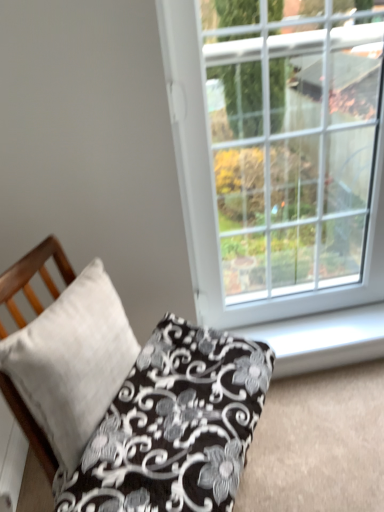
Question: From a real-world perspective, is white plastic window sill at lower right located beneath white plastic window at upper right?

Choices:
 (A) yes
 (B) no

Answer: (A)

Question: Does white plastic window sill at lower right have a greater height compared to white plastic window at upper right?

Choices:
 (A) no
 (B) yes

Answer: (A)

Question: Is white plastic window sill at lower right to the left of white plastic window at upper right from the viewer's perspective?

Choices:
 (A) yes
 (B) no

Answer: (B)

Question: Is white plastic window sill at lower right wider than white plastic window at upper right?

Choices:
 (A) yes
 (B) no

Answer: (A)

Question: From a real-world perspective, is white plastic window sill at lower right on top of white plastic window at upper right?

Choices:
 (A) no
 (B) yes

Answer: (A)

Question: Is white plastic window sill at lower right positioned behind white plastic window at upper right?

Choices:
 (A) no
 (B) yes

Answer: (B)

Question: Can you confirm if white plastic window at upper right is shorter than white plastic window sill at lower right?

Choices:
 (A) yes
 (B) no

Answer: (B)

Question: Is white plastic window at upper right far away from white plastic window sill at lower right?

Choices:
 (A) yes
 (B) no

Answer: (B)

Question: Considering the relative sizes of white plastic window at upper right and white plastic window sill at lower right in the image provided, is white plastic window at upper right taller than white plastic window sill at lower right?

Choices:
 (A) yes
 (B) no

Answer: (A)

Question: Is white plastic window at upper right oriented towards white plastic window sill at lower right?

Choices:
 (A) no
 (B) yes

Answer: (B)

Question: Is white plastic window at upper right behind white plastic window sill at lower right?

Choices:
 (A) no
 (B) yes

Answer: (A)

Question: Is white plastic window at upper right facing away from white plastic window sill at lower right?

Choices:
 (A) yes
 (B) no

Answer: (B)

Question: From the image's perspective, is white plastic window at upper right located above satin white pillow at lower left, which is the 2th pillow in left-to-right order?

Choices:
 (A) yes
 (B) no

Answer: (A)